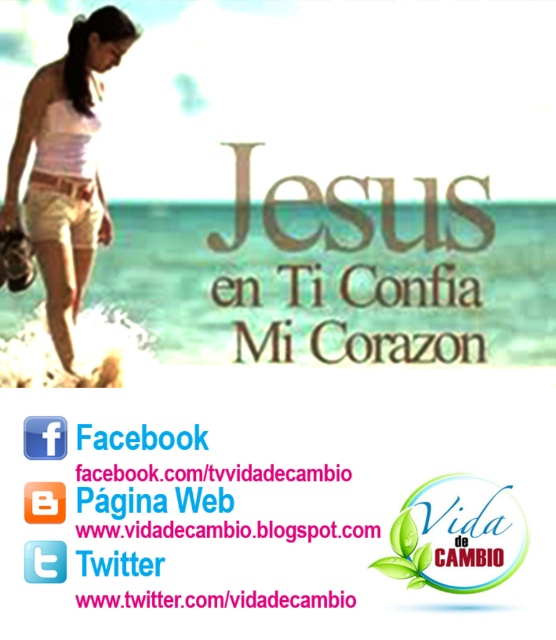
You are a fashion designer observing a beach scene. You notice the white cotton shorts at left and the white matte tank top at upper left. Which clothing item has a greater horizontal width when viewed from the front?

The white cotton shorts at left might be wider than white matte tank top at upper left, so the white cotton shorts at left likely has a greater horizontal width when viewed from the front.

You are a fashion designer observing a model wearing the white cotton shorts at left and the white matte tank top at upper left. Which clothing item is positioned more to the left side of the model?

The white cotton shorts at left are positioned more to the left side of the model than the white matte tank top at upper left.